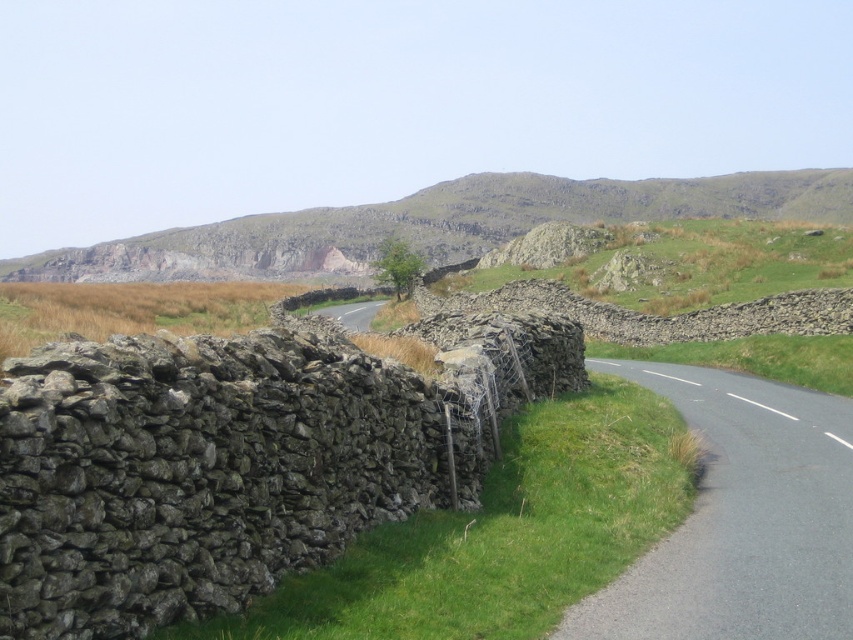
You are standing at the starting point of the road in the rural landscape. You see two points marked on the image, point 1 at coordinates (752, 465) and point 2 at (509, 186). If you want to reach the point that is closer to you, which coordinate should you head towards?

Point 1 at coordinates (752, 465) is closer to the viewer, so you should head towards point 1 at coordinates (752, 465).